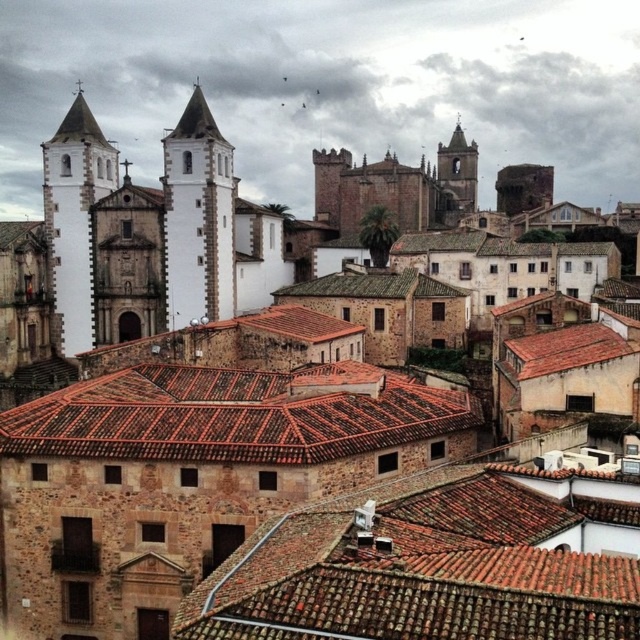
Measure the distance between white stone tower at center and white stone tower at upper left.

A distance of 10.14 meters exists between white stone tower at center and white stone tower at upper left.

Who is more distant from viewer, (205, 288) or (61, 269)?

The point (61, 269) is more distant.

Image resolution: width=640 pixels, height=640 pixels. Identify the location of white stone tower at center. (198, 216).

Who is more forward, [230,449] or [186,138]?

Point [230,449] is more forward.

Identify the location of brown tile roof at center. The height and width of the screenshot is (640, 640). (234, 416).

Does brown clay tile roof at center have a lesser width compared to white stone tower at upper left?

Incorrect, brown clay tile roof at center's width is not less than white stone tower at upper left's.

What do you see at coordinates (436, 563) in the screenshot? I see `brown clay tile roof at center` at bounding box center [436, 563].

Between point (472, 522) and point (52, 269), which one is positioned behind?

The point (52, 269) is behind.

This screenshot has height=640, width=640. Find the location of `brown clay tile roof at center`. brown clay tile roof at center is located at coordinates (436, 563).